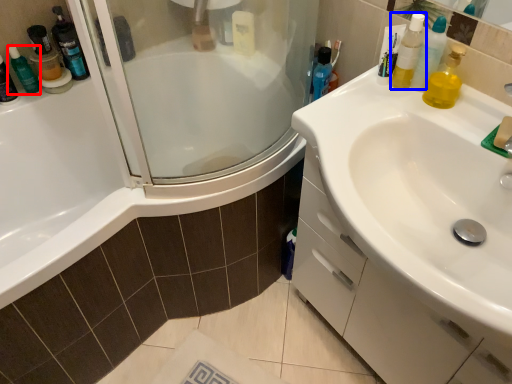
Question: Which point is closer to the camera, toiletry (highlighted by a red box) or mouthwash (highlighted by a blue box)?

Choices:
 (A) toiletry
 (B) mouthwash

Answer: (B)